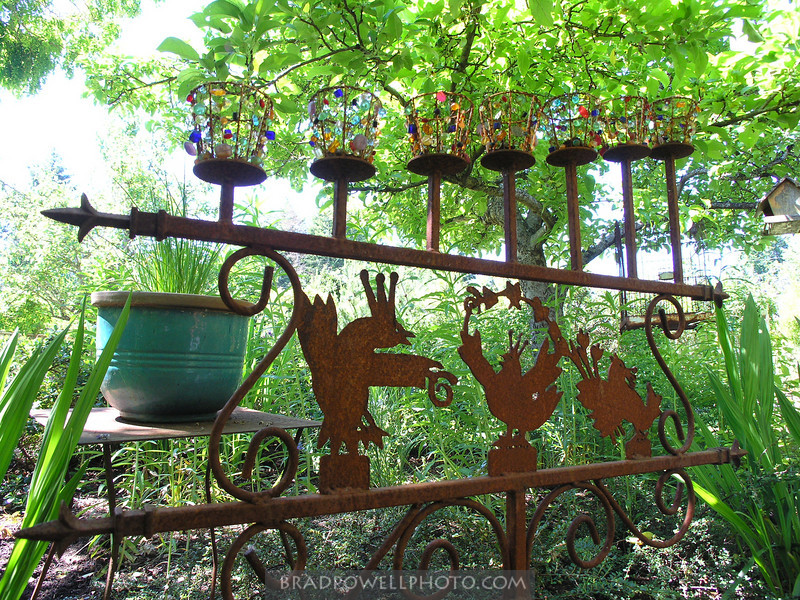
Image resolution: width=800 pixels, height=600 pixels. What are the coordinates of `pot` in the screenshot? It's located at (186, 360).